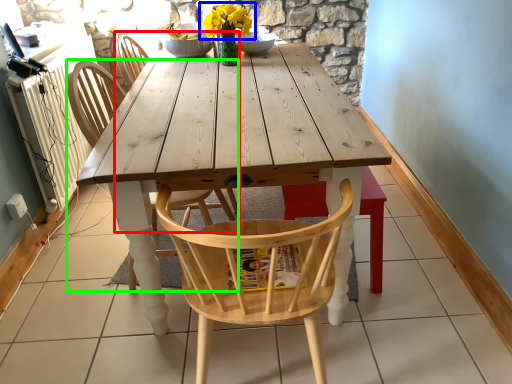
Question: Which object is the closest to the chair (highlighted by a red box)? Choose among these: flower (highlighted by a blue box) or chair (highlighted by a green box).

Choices:
 (A) flower
 (B) chair

Answer: (A)